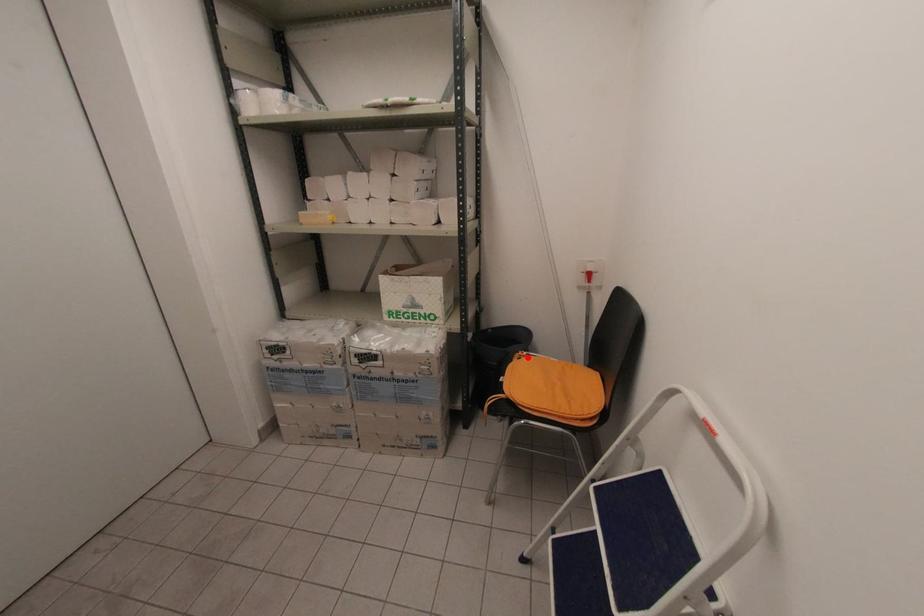
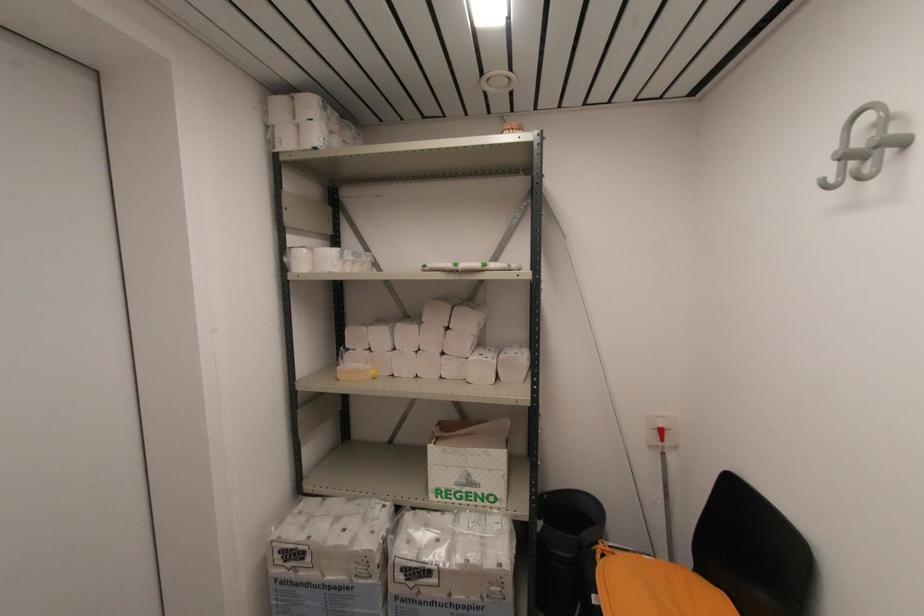
The point at the highlighted location is marked in the first image. Where is the corresponding point in the second image?

(614, 554)